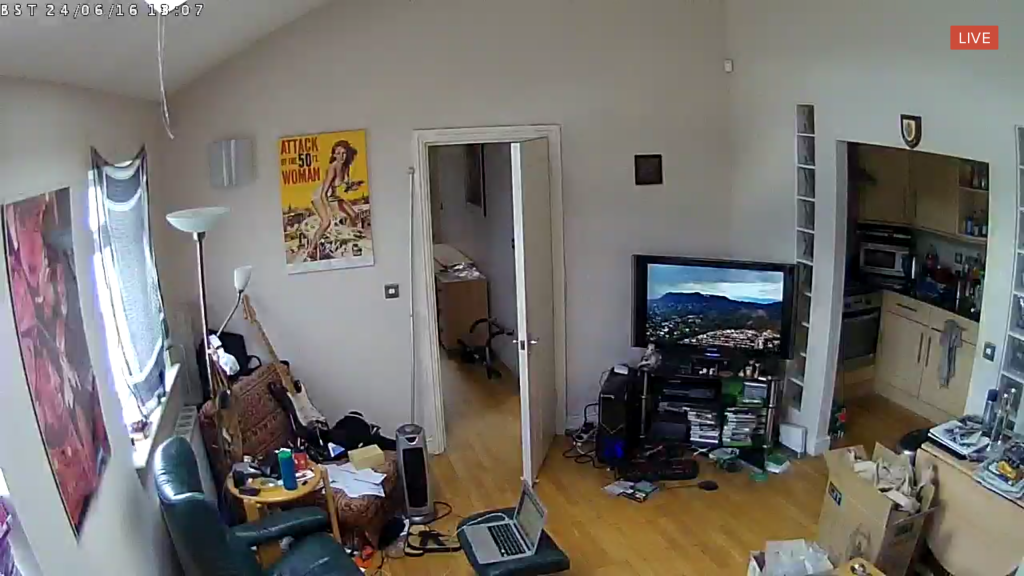
Where is `stove`? This screenshot has height=576, width=1024. stove is located at coordinates click(860, 295).